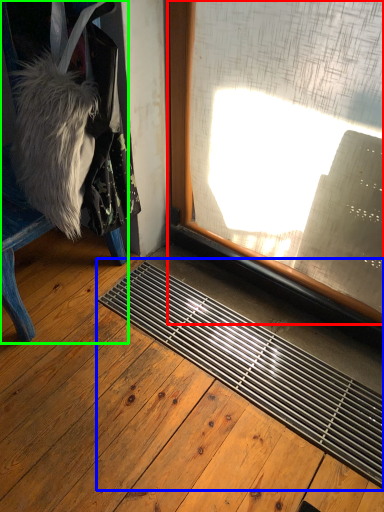
Question: Which is nearer to the window (highlighted by a red box)? doormat (highlighted by a blue box) or furniture (highlighted by a green box).

Choices:
 (A) doormat
 (B) furniture

Answer: (A)